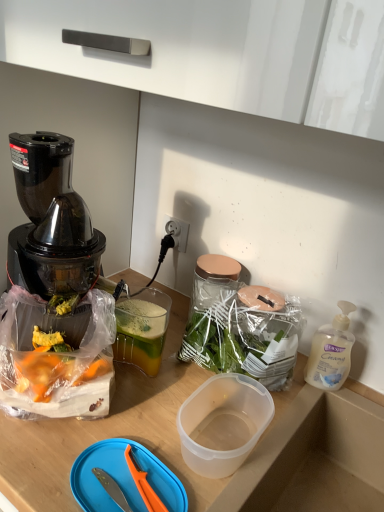
Question: From the image's perspective, is blue plastic cutting board at lower center located above translucent plastic soap dispenser at right?

Choices:
 (A) no
 (B) yes

Answer: (A)

Question: Considering the relative sizes of blue plastic cutting board at lower center and translucent plastic soap dispenser at right in the image provided, is blue plastic cutting board at lower center wider than translucent plastic soap dispenser at right?

Choices:
 (A) no
 (B) yes

Answer: (B)

Question: Considering the relative sizes of blue plastic cutting board at lower center and translucent plastic soap dispenser at right in the image provided, is blue plastic cutting board at lower center shorter than translucent plastic soap dispenser at right?

Choices:
 (A) yes
 (B) no

Answer: (A)

Question: Does blue plastic cutting board at lower center lie behind translucent plastic soap dispenser at right?

Choices:
 (A) no
 (B) yes

Answer: (A)

Question: Can translucent plastic soap dispenser at right be found inside blue plastic cutting board at lower center?

Choices:
 (A) yes
 (B) no

Answer: (B)

Question: Does blue plastic cutting board at lower center touch translucent plastic soap dispenser at right?

Choices:
 (A) yes
 (B) no

Answer: (B)

Question: Considering the relative sizes of translucent plastic soap dispenser at right and blue plastic cutting board at lower center in the image provided, is translucent plastic soap dispenser at right smaller than blue plastic cutting board at lower center?

Choices:
 (A) yes
 (B) no

Answer: (B)

Question: Is translucent plastic soap dispenser at right next to blue plastic cutting board at lower center?

Choices:
 (A) yes
 (B) no

Answer: (B)

Question: From the image's perspective, does translucent plastic soap dispenser at right appear higher than blue plastic cutting board at lower center?

Choices:
 (A) yes
 (B) no

Answer: (A)

Question: Does translucent plastic soap dispenser at right appear on the right side of blue plastic cutting board at lower center?

Choices:
 (A) no
 (B) yes

Answer: (B)

Question: Is the position of translucent plastic soap dispenser at right less distant than that of blue plastic cutting board at lower center?

Choices:
 (A) no
 (B) yes

Answer: (A)

Question: Considering the relative sizes of translucent plastic soap dispenser at right and blue plastic cutting board at lower center in the image provided, is translucent plastic soap dispenser at right wider than blue plastic cutting board at lower center?

Choices:
 (A) no
 (B) yes

Answer: (A)

Question: Is blue plastic cutting board at lower center situated inside translucent plastic soap dispenser at right or outside?

Choices:
 (A) inside
 (B) outside

Answer: (B)